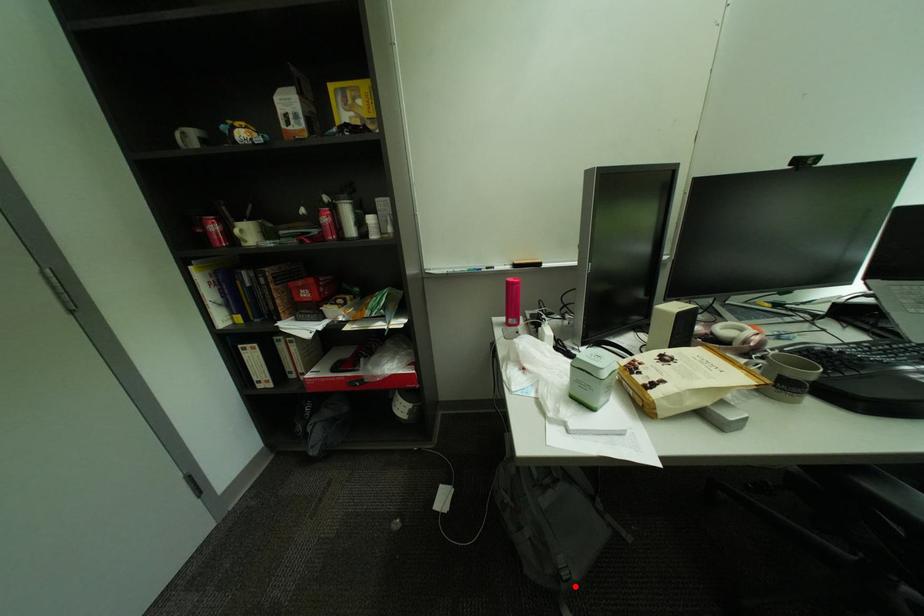
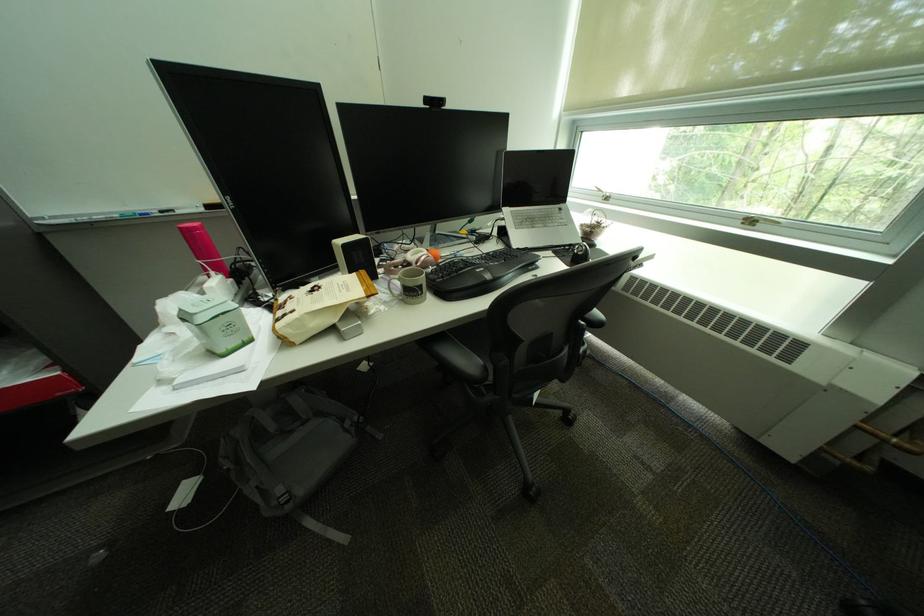
Where in the second image is the point corresponding to the highlighted location from the first image?

(299, 508)